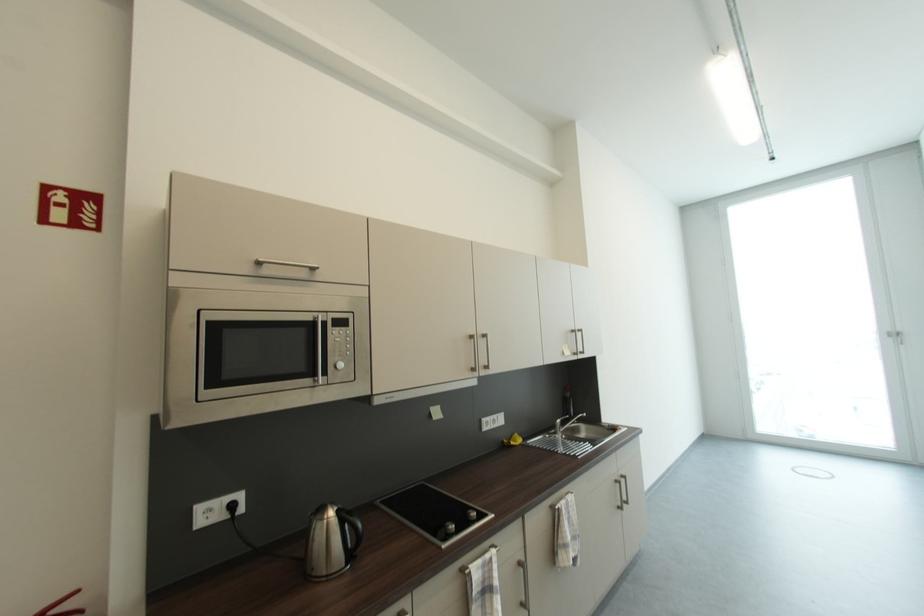
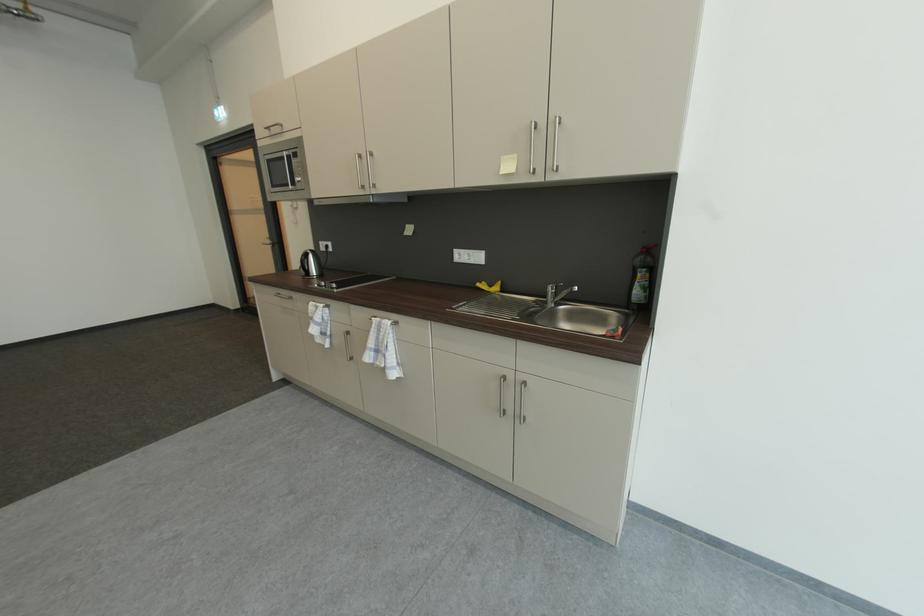
The point at (207, 509) is marked in the first image. Where is the corresponding point in the second image?

(327, 245)